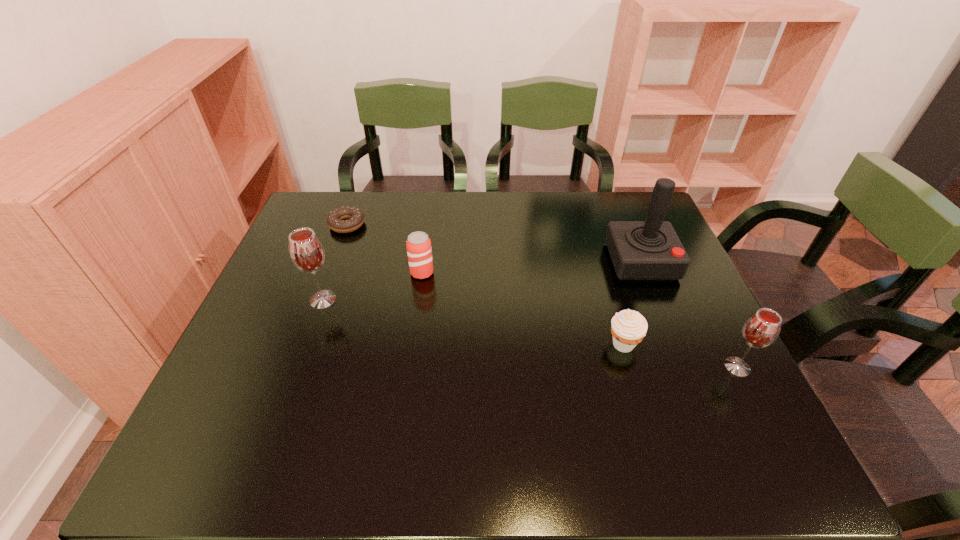
The height and width of the screenshot is (540, 960). Identify the location of vacant area between the farthest object and the farther wineglass. (335, 262).

Where is `vacant space that is in between the right wineglass and the fourth object from right to left`? The image size is (960, 540). vacant space that is in between the right wineglass and the fourth object from right to left is located at coordinates (580, 320).

Identify the location of free spot between the tallest object and the second tallest object. (482, 281).

This screenshot has width=960, height=540. Identify the location of vacant point located between the shorter wineglass and the farthest object. (542, 296).

Where is `object that is the closest one to the farther wineglass`? Image resolution: width=960 pixels, height=540 pixels. object that is the closest one to the farther wineglass is located at coordinates (418, 245).

Select which object appears as the fourth closest to the muffin. Please provide its 2D coordinates. Your answer should be formatted as a tuple, i.e. [(x, y)], where the tuple contains the x and y coordinates of a point satisfying the conditions above.

[(306, 251)]

Where is `blank area in the image that satisfies the following two spatial constraints: 1. on the base of the joystick; 2. on the left side of the fourth shortest object`? This screenshot has height=540, width=960. blank area in the image that satisfies the following two spatial constraints: 1. on the base of the joystick; 2. on the left side of the fourth shortest object is located at coordinates (684, 367).

Image resolution: width=960 pixels, height=540 pixels. Identify the location of blank area in the image that satisfies the following two spatial constraints: 1. on the front side of the muffin; 2. on the left side of the taller wineglass. (307, 344).